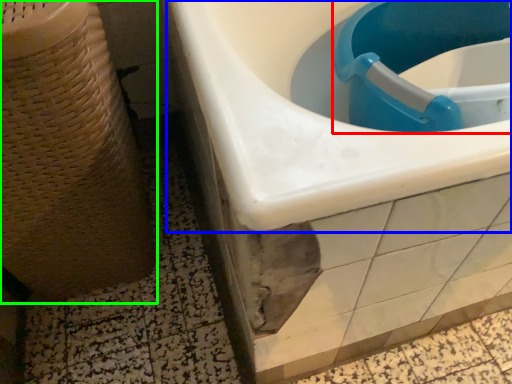
Question: Estimate the real-world distances between objects in this image. Which object is closer to sink (highlighted by a red box), sink (highlighted by a blue box) or potty (highlighted by a green box)?

Choices:
 (A) sink
 (B) potty

Answer: (A)